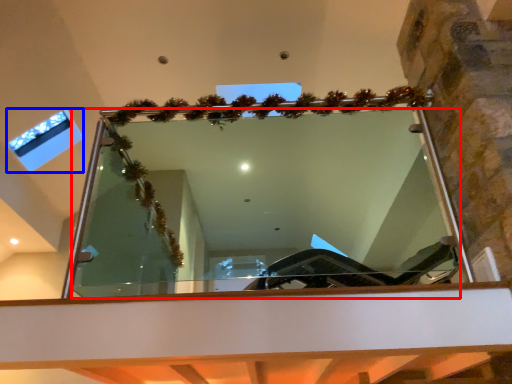
Question: Which object is further to the camera taking this photo, mirror (highlighted by a red box) or window (highlighted by a blue box)?

Choices:
 (A) mirror
 (B) window

Answer: (B)